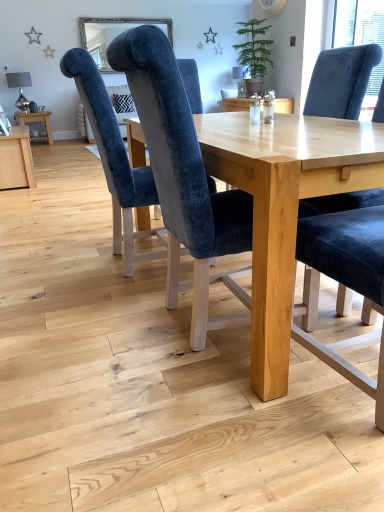
Identify the location of vacant space underneath velvet blue chair at center, acting as the 1th chair starting from the left (from a real-world perspective). (133, 264).